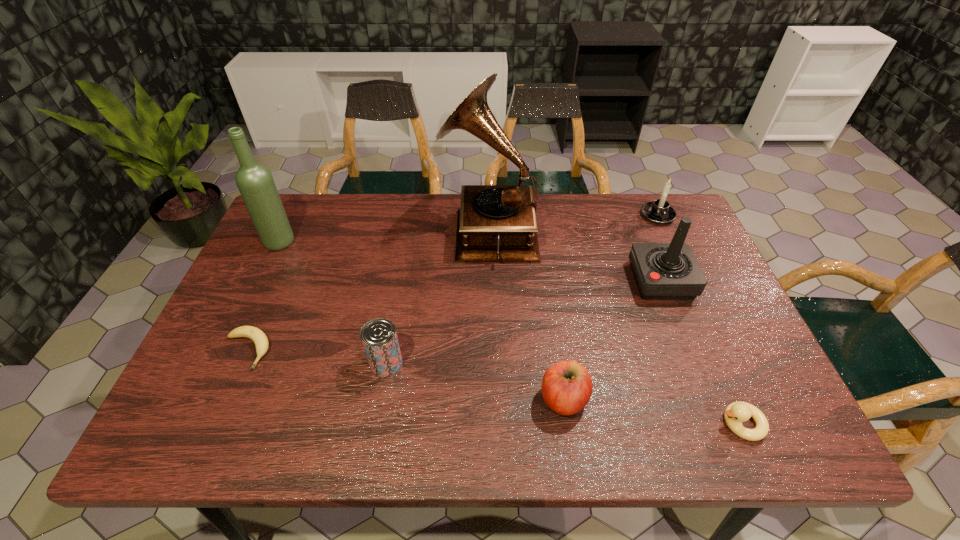
The width and height of the screenshot is (960, 540). Find the location of `the tallest object`. the tallest object is located at coordinates (495, 223).

You are a GUI agent. You are given a task and a screenshot of the screen. Output one action in this format:
    pyautogui.click(x=<x>, y=<y>)
    Task: Click on the wine bottle
    This screenshot has width=960, height=540.
    Given the screenshot: What is the action you would take?
    pyautogui.click(x=255, y=182)

You are a GUI agent. You are given a task and a screenshot of the screen. Output one action in this format:
    pyautogui.click(x=<x>, y=<y>)
    Task: Click on the third tallest object
    The width and height of the screenshot is (960, 540).
    Given the screenshot: What is the action you would take?
    pyautogui.click(x=663, y=271)

This screenshot has height=540, width=960. What are the coordinates of `the fifth shortest object` in the screenshot? It's located at (659, 211).

The image size is (960, 540). I want to click on the third object from left to right, so click(379, 338).

Locate an element on the screen. The width and height of the screenshot is (960, 540). apple is located at coordinates (567, 386).

This screenshot has width=960, height=540. What are the coordinates of `the second shortest object` in the screenshot? It's located at click(x=735, y=413).

You are a GUI agent. You are given a task and a screenshot of the screen. Output one action in this format:
    pyautogui.click(x=<x>, y=<y>)
    Task: Click on the shortest object
    The height and width of the screenshot is (540, 960).
    Given the screenshot: What is the action you would take?
    pyautogui.click(x=259, y=338)

Find the location of a particular element. vacant space located 0.360m on the horn of the record player is located at coordinates (325, 230).

Identify the location of vacant space positioned 0.210m on the horn of the record player. Image resolution: width=960 pixels, height=540 pixels. (374, 230).